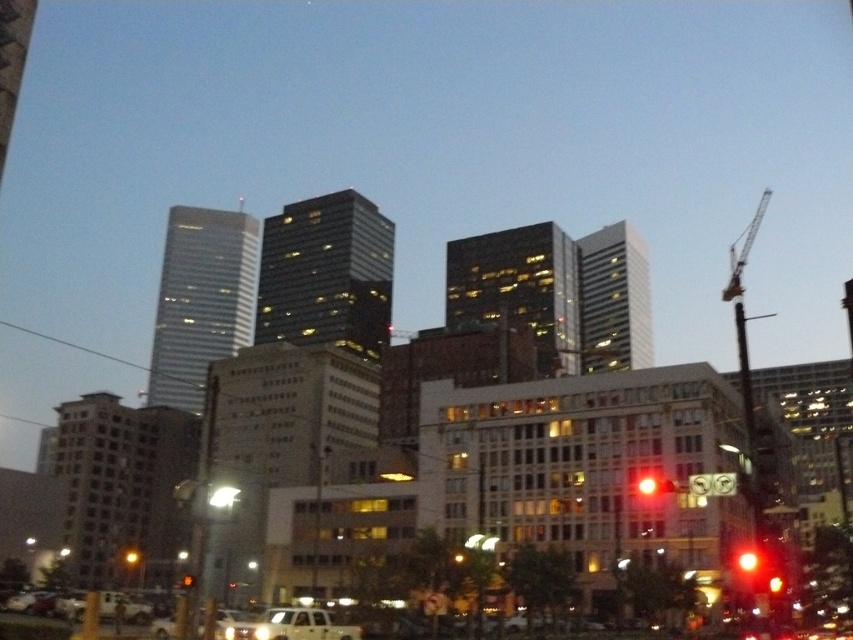
Based on the photo, can you confirm if white matte van at lower center is positioned to the right of red glass traffic light at center?

Correct, you'll find white matte van at lower center to the right of red glass traffic light at center.

Does white matte van at lower center have a greater height compared to red glass traffic light at center?

In fact, white matte van at lower center may be shorter than red glass traffic light at center.

Does point (312, 616) come farther from viewer compared to point (187, 588)?

Yes, point (312, 616) is behind point (187, 588).

I want to click on white matte van at lower center, so (x=291, y=625).